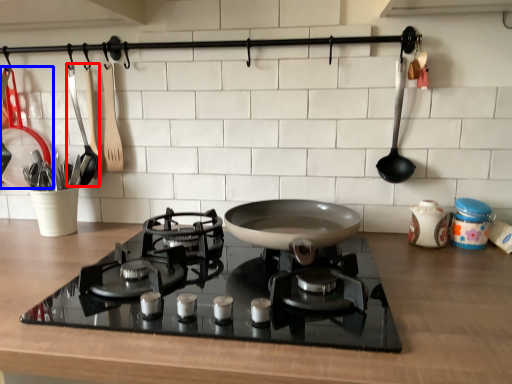
Question: Among these objects, which one is nearest to the camera, kitchen appliance (highlighted by a red box) or kitchen appliance (highlighted by a blue box)?

Choices:
 (A) kitchen appliance
 (B) kitchen appliance

Answer: (B)